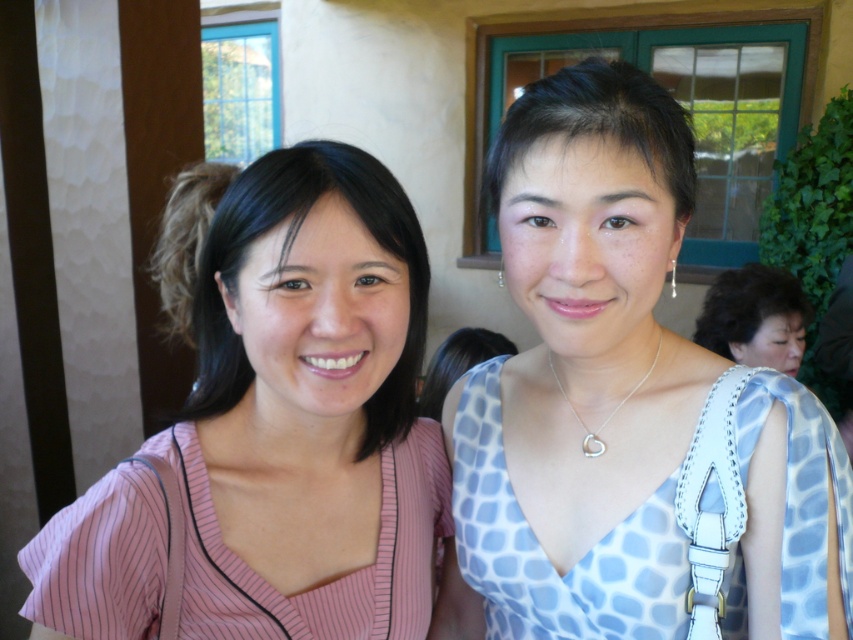
Can you confirm if pink striped fabric dress at left is positioned above silver/smooth heart at center?

No, pink striped fabric dress at left is not above silver/smooth heart at center.

Who is more distant from viewer, (149, 621) or (595, 438)?

Positioned behind is point (595, 438).

Is point (160, 516) closer to viewer compared to point (550, 365)?

That is True.

At what (x,y) coordinates should I click in order to perform the action: click on pink striped fabric dress at left. Please return your answer as a coordinate pair (x, y). This screenshot has width=853, height=640. Looking at the image, I should click on (329, 580).

Does light blue printed dress at center have a larger size compared to pink striped fabric dress at left?

Correct, light blue printed dress at center is larger in size than pink striped fabric dress at left.

Does light blue printed dress at center have a lesser width compared to pink striped fabric dress at left?

Yes, light blue printed dress at center is thinner than pink striped fabric dress at left.

Locate an element on the screen. The height and width of the screenshot is (640, 853). light blue printed dress at center is located at coordinates (631, 406).

Find the location of a particular element. Image resolution: width=853 pixels, height=640 pixels. light blue printed dress at center is located at coordinates (631, 406).

Can you confirm if light blue dotted dress at center is wider than silver/smooth heart at center?

Yes.

Is point (741, 362) farther from viewer compared to point (619, 404)?

Yes, point (741, 362) is farther from viewer.

Is point (752, 294) less distant than point (572, 406)?

No, (752, 294) is further to viewer.

You are a GUI agent. You are given a task and a screenshot of the screen. Output one action in this format:
    pyautogui.click(x=<x>, y=<y>)
    Task: Click on the light blue dotted dress at center
    
    Given the screenshot: What is the action you would take?
    pyautogui.click(x=755, y=317)